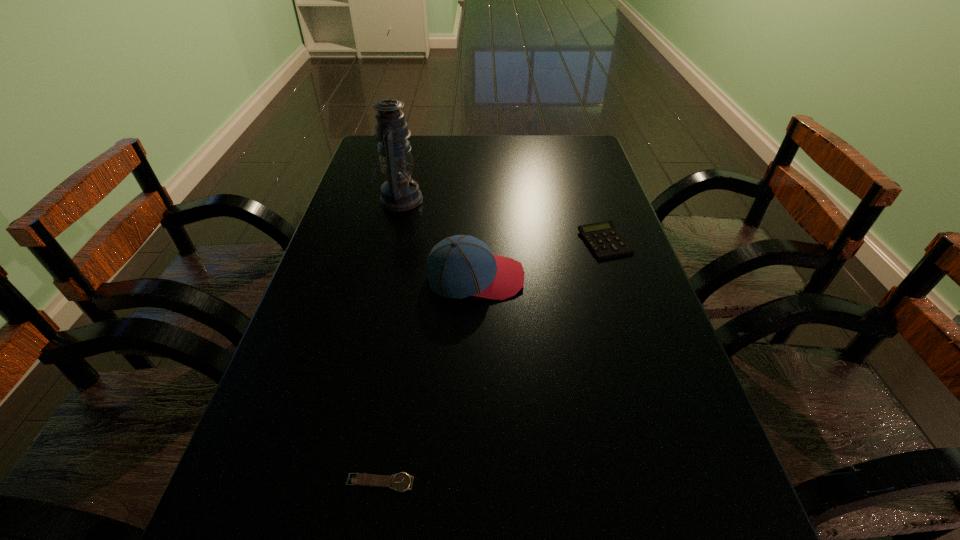
Locate an element on the screen. The image size is (960, 540). vacant space that satisfies the following two spatial constraints: 1. on the front-facing side of the watch; 2. on the right side of the farthest object is located at coordinates (330, 483).

Where is `vacant region that satisfies the following two spatial constraints: 1. on the back side of the shortest object; 2. on the front-facing side of the tallest object`? The image size is (960, 540). vacant region that satisfies the following two spatial constraints: 1. on the back side of the shortest object; 2. on the front-facing side of the tallest object is located at coordinates (426, 199).

Locate an element on the screen. The width and height of the screenshot is (960, 540). vacant space that satisfies the following two spatial constraints: 1. on the front-facing side of the lantern; 2. on the right side of the nearest object is located at coordinates (330, 483).

The image size is (960, 540). In order to click on vacant space that satisfies the following two spatial constraints: 1. on the front-facing side of the farthest object; 2. on the right side of the nearest object in this screenshot , I will do `click(330, 483)`.

Identify the location of vacant point that satisfies the following two spatial constraints: 1. on the front-facing side of the tallest object; 2. on the left side of the watch. (330, 483).

This screenshot has width=960, height=540. Identify the location of free spot that satisfies the following two spatial constraints: 1. on the front-facing side of the rightmost object; 2. on the right side of the tallest object. (389, 242).

Where is `vacant space that satisfies the following two spatial constraints: 1. on the front-facing side of the lantern; 2. on the back side of the calculator`? This screenshot has width=960, height=540. vacant space that satisfies the following two spatial constraints: 1. on the front-facing side of the lantern; 2. on the back side of the calculator is located at coordinates (389, 242).